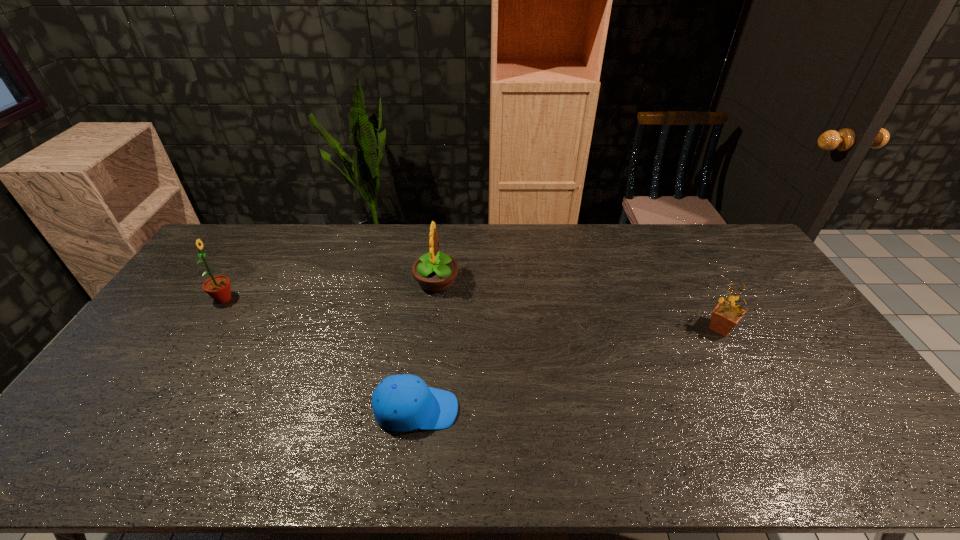
Locate which object is the third closest to the leftmost object. Please provide its 2D coordinates. Your answer should be formatted as a tuple, i.e. [(x, y)], where the tuple contains the x and y coordinates of a point satisfying the conditions above.

[(725, 316)]

The width and height of the screenshot is (960, 540). Identify the location of sunflower object that ranks as the closest to the second sunflower from right to left. (218, 287).

This screenshot has height=540, width=960. Find the location of `the second closest sunflower to the leftmost sunflower`. the second closest sunflower to the leftmost sunflower is located at coordinates (725, 316).